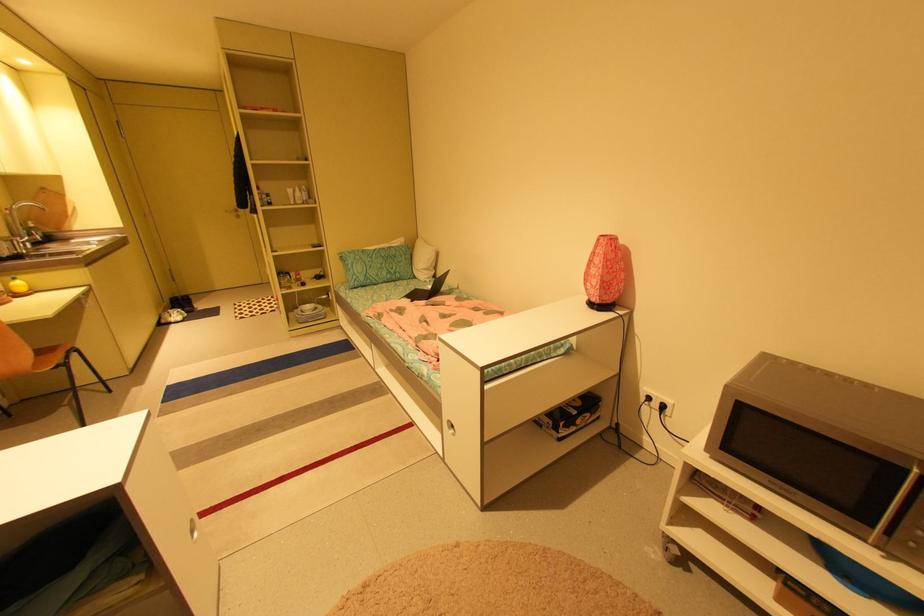
I want to click on drawer pull hole, so click(x=450, y=428).